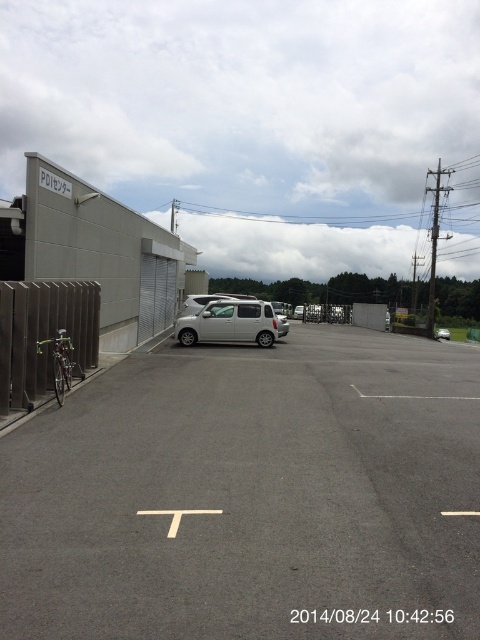
You are standing at the center of the image and want to walk towards the gray asphalt parking lot at left. Which direction should you face?

Since the gray asphalt parking lot at left is located at point 0.775 on the x axis and 0.523 on the y axis, you should face towards the left direction to walk towards it.

You are standing at the point labeled point (x=251, y=496) in the image. What type of surface are you standing on?

You are standing on the gray asphalt parking lot at left.

You are a delivery person trying to park your vehicle in the gray asphalt parking lot at left. There is a satin silver van at center blocking the entrance. Can you drive around the van to access the parking lot?

The gray asphalt parking lot at left is positioned on the left side of the satin silver van at center, so you can drive around the van to the left to access the parking lot.